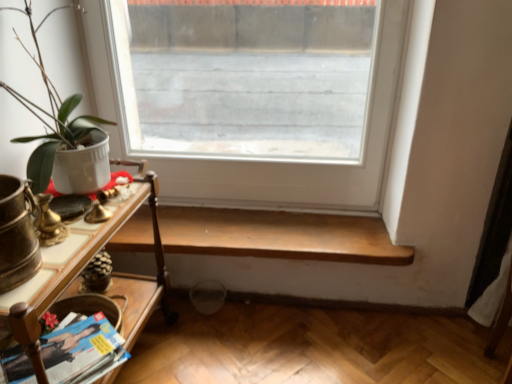
Question: Does matte paper magazine at lower left turn towards wooden table at left?

Choices:
 (A) no
 (B) yes

Answer: (B)

Question: Can you confirm if matte paper magazine at lower left is bigger than wooden table at left?

Choices:
 (A) no
 (B) yes

Answer: (A)

Question: Is matte paper magazine at lower left directly adjacent to wooden table at left?

Choices:
 (A) no
 (B) yes

Answer: (A)

Question: Does matte paper magazine at lower left have a lesser height compared to wooden table at left?

Choices:
 (A) no
 (B) yes

Answer: (B)

Question: Is matte paper magazine at lower left at the left side of wooden table at left?

Choices:
 (A) yes
 (B) no

Answer: (A)

Question: Choose the correct answer: Is wooden table at left inside clear glass window at center or outside it?

Choices:
 (A) inside
 (B) outside

Answer: (B)

Question: In terms of width, does wooden table at left look wider or thinner when compared to clear glass window at center?

Choices:
 (A) thin
 (B) wide

Answer: (B)

Question: Is wooden table at left taller or shorter than clear glass window at center?

Choices:
 (A) short
 (B) tall

Answer: (A)

Question: Relative to clear glass window at center, is wooden table at left in front or behind?

Choices:
 (A) front
 (B) behind

Answer: (A)

Question: Considering the positions of wooden shelf at lower center and wooden table at left in the image, is wooden shelf at lower center taller or shorter than wooden table at left?

Choices:
 (A) tall
 (B) short

Answer: (B)

Question: In the image, is wooden shelf at lower center positioned in front of or behind wooden table at left?

Choices:
 (A) behind
 (B) front

Answer: (A)

Question: Considering the positions of point (410, 259) and point (135, 339), is point (410, 259) closer or farther from the camera than point (135, 339)?

Choices:
 (A) closer
 (B) farther

Answer: (B)

Question: Is wooden shelf at lower center wider or thinner than wooden table at left?

Choices:
 (A) wide
 (B) thin

Answer: (B)

Question: Is point (14, 347) closer or farther from the camera than point (92, 122)?

Choices:
 (A) closer
 (B) farther

Answer: (A)

Question: Considering the positions of matte paper magazine at lower left and matte white pot at left in the image, is matte paper magazine at lower left taller or shorter than matte white pot at left?

Choices:
 (A) short
 (B) tall

Answer: (A)